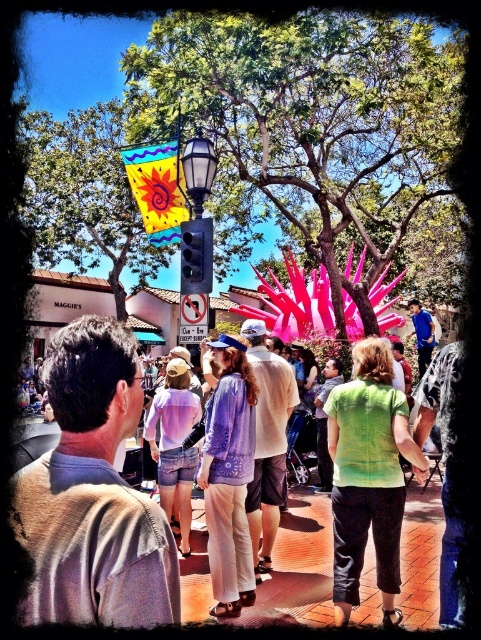
Is pastel tie-dye shirt at center bigger than metallic traffic light at center?

Correct, pastel tie-dye shirt at center is larger in size than metallic traffic light at center.

Is pastel tie-dye shirt at center closer to camera compared to metallic traffic light at center?

That is True.

Is point (176, 604) closer to viewer compared to point (207, 282)?

Yes.

Find the location of a particular element. This screenshot has width=481, height=640. pastel tie-dye shirt at center is located at coordinates (93, 550).

The image size is (481, 640). I want to click on matte black lamp post at center, so click(x=197, y=232).

Does pastel tie-dye shirt at center appear on the left side of matte black lamp post at center?

Incorrect, pastel tie-dye shirt at center is not on the left side of matte black lamp post at center.

Does pastel tie-dye shirt at center have a smaller size compared to matte black lamp post at center?

No.

What are the coordinates of `pastel tie-dye shirt at center` in the screenshot? It's located at (93, 550).